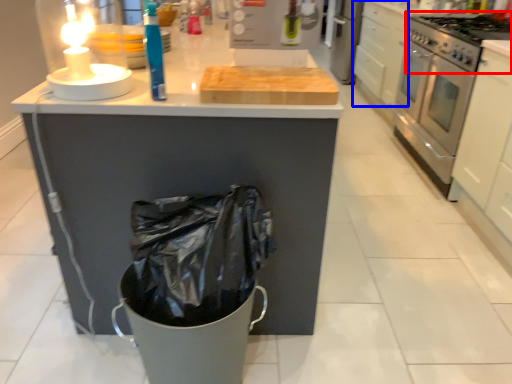
Question: Among these objects, which one is nearest to the camera, gas stove (highlighted by a red box) or drawer (highlighted by a blue box)?

Choices:
 (A) gas stove
 (B) drawer

Answer: (A)